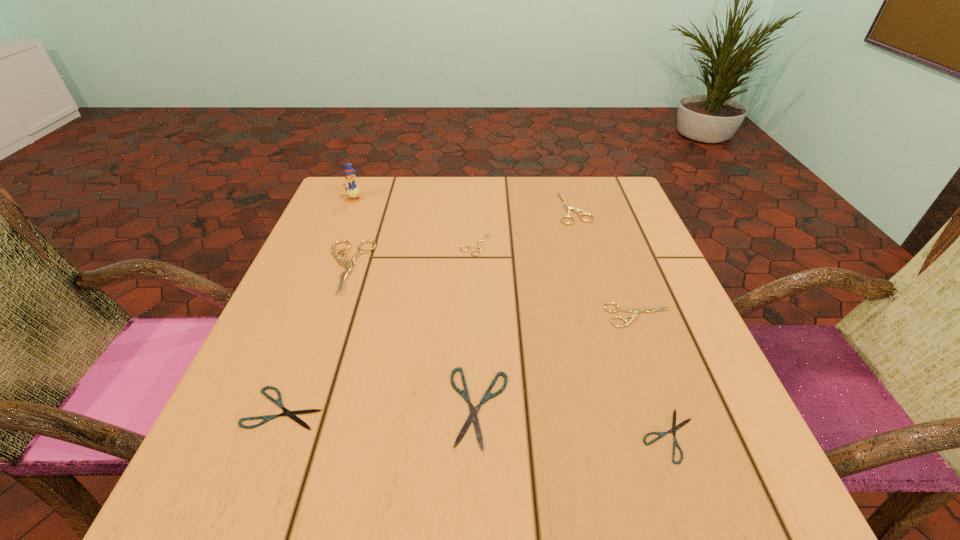
The image size is (960, 540). Identify the location of free spot located on the left of the rightmost black shears. (510, 435).

Find the location of a particular element. The width and height of the screenshot is (960, 540). duckling situated at the far edge is located at coordinates (352, 190).

This screenshot has width=960, height=540. Find the location of `shears that is positioned at the far edge`. shears that is positioned at the far edge is located at coordinates (577, 210).

Find the location of a particular element. This screenshot has height=540, width=960. duckling that is at the left edge is located at coordinates (352, 190).

Find the location of a particular element. object situated at the far left corner is located at coordinates (352, 190).

The height and width of the screenshot is (540, 960). I want to click on object at the far right corner, so click(x=577, y=210).

Image resolution: width=960 pixels, height=540 pixels. I want to click on object present at the near right corner, so click(674, 428).

Where is `free space at the far edge of the desktop`? This screenshot has height=540, width=960. free space at the far edge of the desktop is located at coordinates (512, 181).

Identify the location of vacant space at the near edge. (459, 474).

This screenshot has height=540, width=960. In order to click on blank space at the left edge of the desktop in this screenshot , I will do `click(338, 235)`.